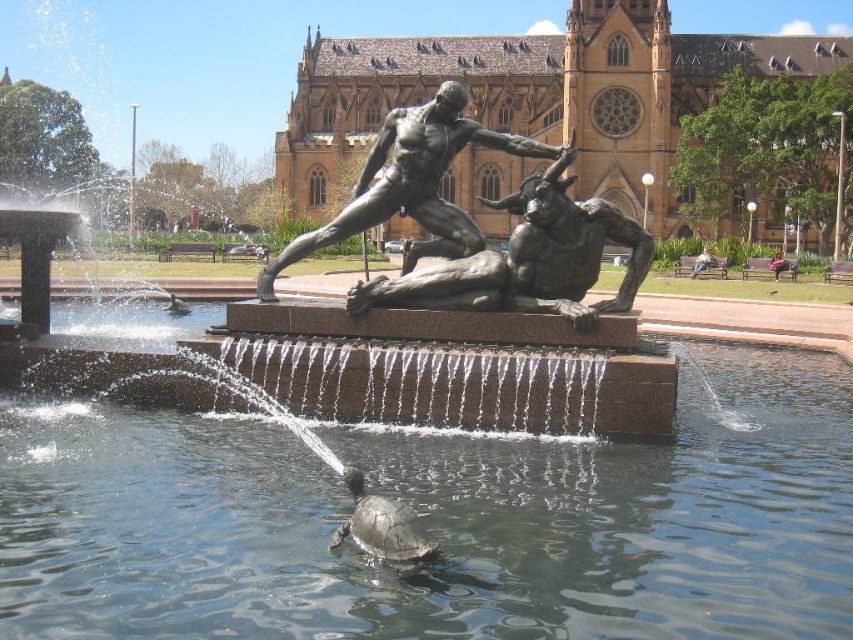
Question: Which point is closer to the camera?

Choices:
 (A) (173, 300)
 (B) (358, 529)
 (C) (694, 536)
 (D) (700, 266)

Answer: (B)

Question: Can you confirm if bronze/sculpture at center is positioned to the right of light brown wooden bench at center right?

Choices:
 (A) yes
 (B) no

Answer: (B)

Question: Can you confirm if bronze statue at center is positioned above bronze/sculpture at center?

Choices:
 (A) no
 (B) yes

Answer: (A)

Question: Which of these objects is positioned farthest from the shiny dark gray tortoise at center?

Choices:
 (A) light brown wooden bench at center right
 (B) bronze/sculpture at center
 (C) clear water at fountain center

Answer: (A)

Question: Can you confirm if clear water at fountain center is positioned to the right of bronze/sculpture at center?

Choices:
 (A) yes
 (B) no

Answer: (A)

Question: Considering the real-world distances, which object is closest to the clear water at fountain center?

Choices:
 (A) light brown wooden bench at center right
 (B) bronze/sculpture at center
 (C) light brown wooden bench at right
 (D) bronze statue at center

Answer: (D)